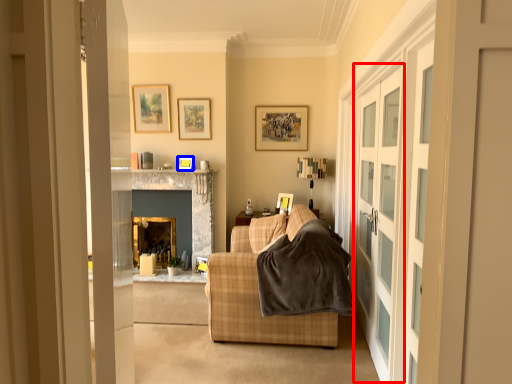
Question: Which of the following is the farthest to the observer, screen door (highlighted by a red box) or picture frame (highlighted by a blue box)?

Choices:
 (A) screen door
 (B) picture frame

Answer: (B)